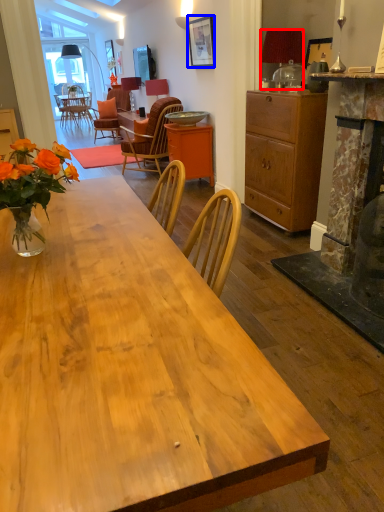
Question: Which object is further to the camera taking this photo, lamp (highlighted by a red box) or picture frame (highlighted by a blue box)?

Choices:
 (A) lamp
 (B) picture frame

Answer: (B)